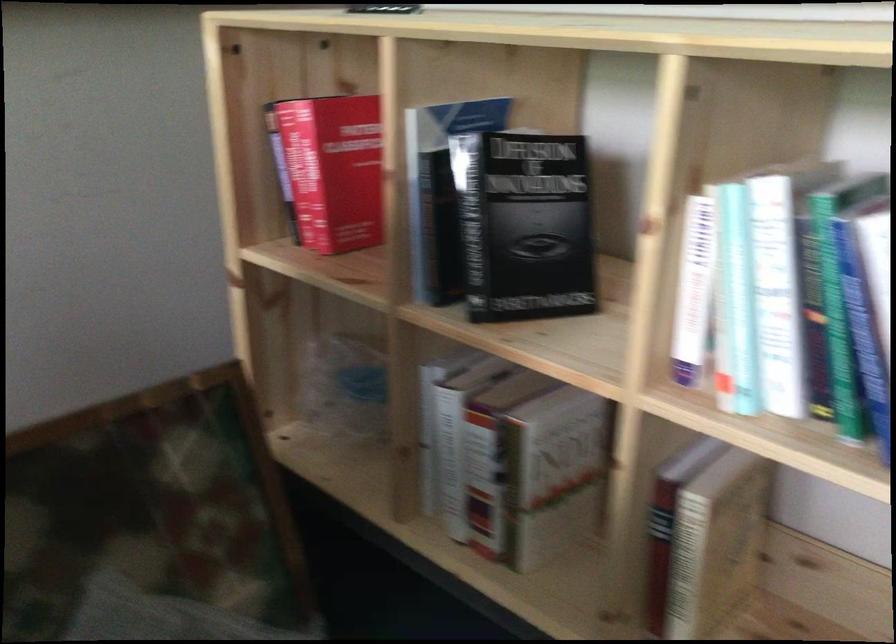
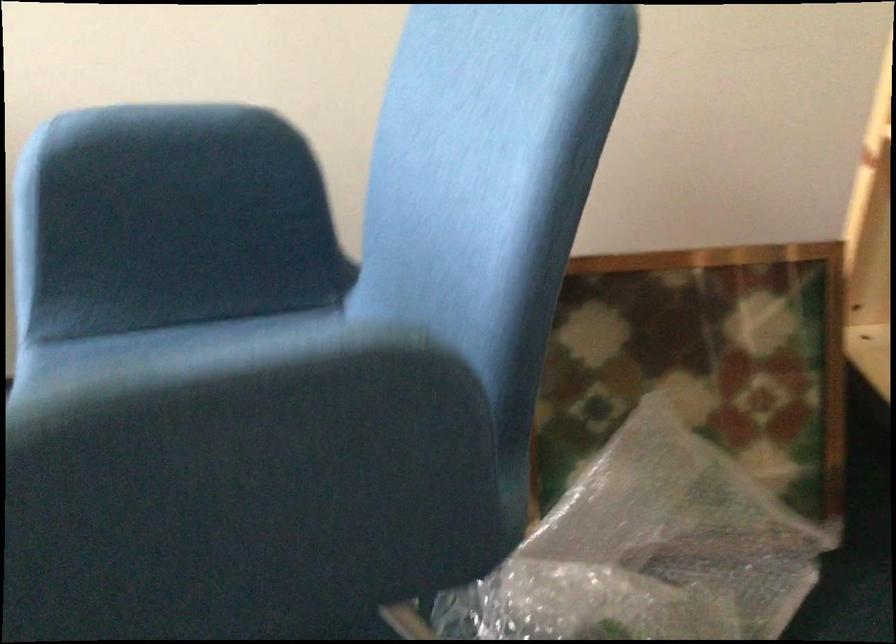
Where in the second image is the point corresponding to pixel 151 515 from the first image?

(702, 363)